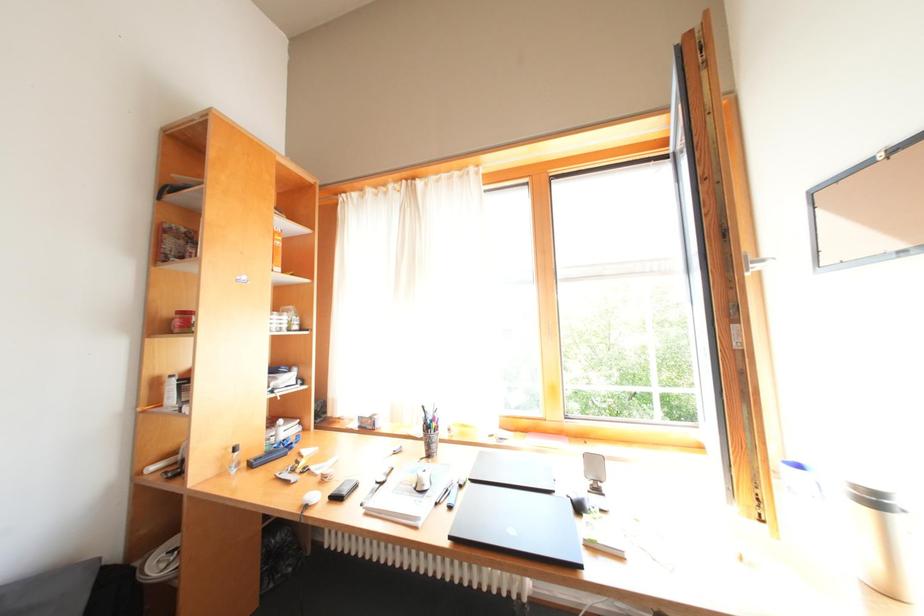
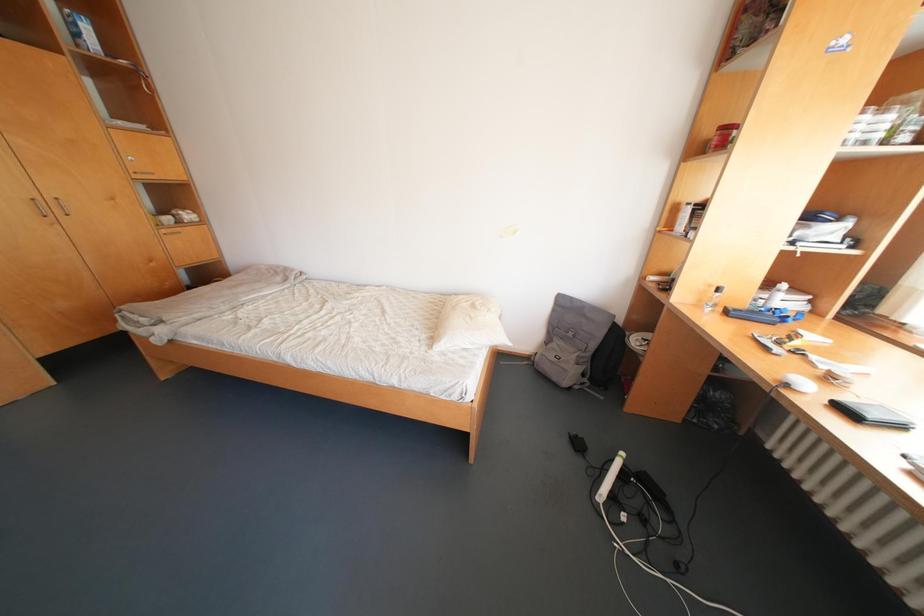
First-person continuous shooting, in which direction is the camera rotating?

The rotation direction of the camera is left-down.